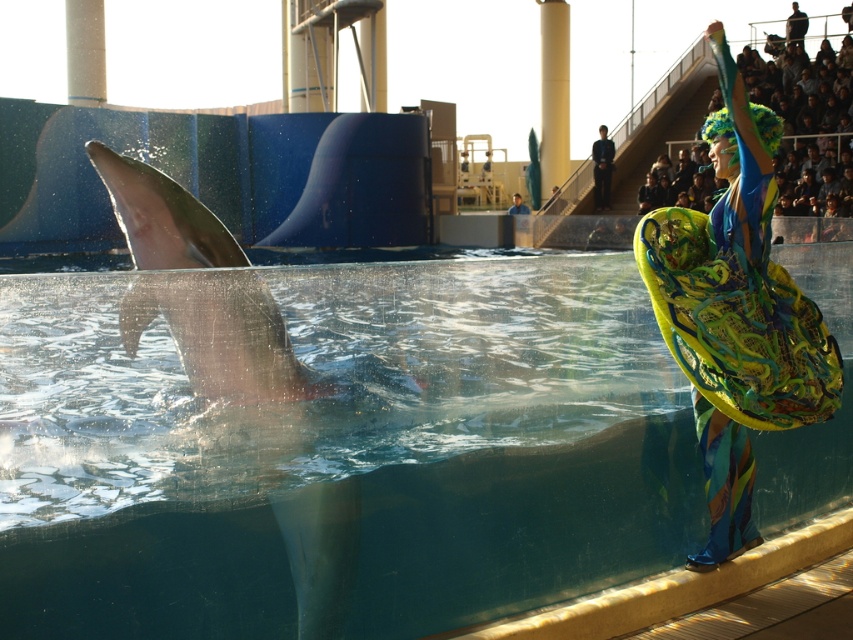
Question: Is transparent glass pool at center positioned before smooth gray dolphin at left?

Choices:
 (A) no
 (B) yes

Answer: (B)

Question: Which of the following is the closest to the observer?

Choices:
 (A) (485, 538)
 (B) (677, 244)
 (C) (283, 378)

Answer: (C)

Question: Can you confirm if transparent glass pool at center is positioned to the left of multicolored fabric fan at right?

Choices:
 (A) no
 (B) yes

Answer: (B)

Question: Which is nearer to the multicolored fabric fan at right?

Choices:
 (A) smooth gray dolphin at left
 (B) black smooth suit at upper center

Answer: (A)

Question: Is multicolored fabric fan at right below smooth gray dolphin at left?

Choices:
 (A) yes
 (B) no

Answer: (B)

Question: Which point is farther to the camera?

Choices:
 (A) transparent glass pool at center
 (B) smooth gray dolphin at left

Answer: (B)